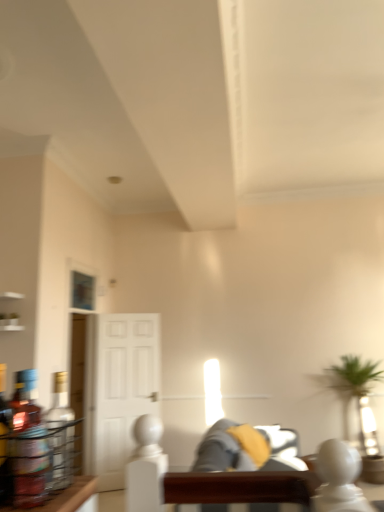
Describe the element at coordinates (60, 434) in the screenshot. Image resolution: width=384 pixels, height=512 pixels. I see `translucent glass bottle at left, the second bottle in the front-to-back sequence` at that location.

I want to click on translucent glass bottle at left, placed as the 1th bottle when sorted from front to back, so click(x=28, y=443).

At what (x,y) coordinates should I click in order to perform the action: click on white glossy door at center. Please return your answer as a coordinate pair (x, y). Looking at the image, I should click on (119, 389).

You are a GUI agent. You are given a task and a screenshot of the screen. Output one action in this format:
    pyautogui.click(x=<x>, y=<y>)
    Task: Click on the translucent glass bottle at left, the second bottle in the front-to-back sequence
    Image resolution: width=384 pixels, height=512 pixels.
    Given the screenshot: What is the action you would take?
    pyautogui.click(x=60, y=434)

Find the location of `glass door positioned vertically above the soft gray fabric couch at center, positioned as the second couch in back-to-front order (from a real-world perspective)`. glass door positioned vertically above the soft gray fabric couch at center, positioned as the second couch in back-to-front order (from a real-world perspective) is located at coordinates (119, 389).

Consider the image. From a real-world perspective, which is physically above, soft gray fabric couch at center, the 1th couch in the front-to-back sequence, or white glossy door at center?

white glossy door at center, from a real-world perspective.

Is soft gray fabric couch at center, positioned as the second couch in back-to-front order, beside white glossy door at center?

soft gray fabric couch at center, positioned as the second couch in back-to-front order, and white glossy door at center are clearly separated.

Can we say soft gray fabric couch at center, the 1th couch in the front-to-back sequence, lies outside white glossy door at center?

soft gray fabric couch at center, the 1th couch in the front-to-back sequence, is positioned outside white glossy door at center.

Is white glossy door at center inside or outside of soft gray fabric couch at center, positioned as the second couch in back-to-front order?

white glossy door at center is spatially situated outside soft gray fabric couch at center, positioned as the second couch in back-to-front order.

In the scene shown: Considering the relative sizes of white glossy door at center and soft gray fabric couch at center, the 1th couch in the front-to-back sequence, in the image provided, is white glossy door at center bigger than soft gray fabric couch at center, the 1th couch in the front-to-back sequence,?

Actually, white glossy door at center might be smaller than soft gray fabric couch at center, the 1th couch in the front-to-back sequence.

From a real-world perspective, relative to soft gray fabric couch at center, positioned as the second couch in back-to-front order, is white glossy door at center vertically above or below?

From a real-world perspective, white glossy door at center is physically above soft gray fabric couch at center, positioned as the second couch in back-to-front order.

Considering their positions, is white glossy door at center located in front of or behind soft gray fabric couch at center, the 1th couch in the front-to-back sequence?

white glossy door at center is behind soft gray fabric couch at center, the 1th couch in the front-to-back sequence.

Considering the sizes of objects gray fabric couch at center, arranged as the 2th couch when viewed from the front, and translucent glass bottle at left, the 1th bottle from the back, in the image provided, who is shorter, gray fabric couch at center, arranged as the 2th couch when viewed from the front, or translucent glass bottle at left, the 1th bottle from the back,?

translucent glass bottle at left, the 1th bottle from the back, is shorter.

Considering the relative sizes of gray fabric couch at center, arranged as the 2th couch when viewed from the front, and translucent glass bottle at left, the 1th bottle from the back, in the image provided, is gray fabric couch at center, arranged as the 2th couch when viewed from the front, bigger than translucent glass bottle at left, the 1th bottle from the back,?

Indeed, gray fabric couch at center, arranged as the 2th couch when viewed from the front, has a larger size compared to translucent glass bottle at left, the 1th bottle from the back.

Is gray fabric couch at center, the 1th couch positioned from the back, oriented towards translucent glass bottle at left, the second bottle in the front-to-back sequence?

No, gray fabric couch at center, the 1th couch positioned from the back, is not oriented towards translucent glass bottle at left, the second bottle in the front-to-back sequence.

Which is behind, point (217, 467) or point (64, 473)?

The point (217, 467) is farther from the camera.

Between white glossy door at center and translucent glass bottle at left, the second bottle in the front-to-back sequence, which one appears on the left side from the viewer's perspective?

white glossy door at center.

Locate an element on the screen. glass door below the translucent glass bottle at left, the second bottle in the front-to-back sequence (from the image's perspective) is located at coordinates (119, 389).

Is white glossy door at center shorter than translucent glass bottle at left, the second bottle in the front-to-back sequence?

In fact, white glossy door at center may be taller than translucent glass bottle at left, the second bottle in the front-to-back sequence.

Between white glossy door at center and translucent glass bottle at left, the 1th bottle from the back, which one has larger width?

With larger width is white glossy door at center.

The image size is (384, 512). I want to click on couch located on the left of soft gray fabric couch at center, positioned as the second couch in back-to-front order, so click(x=248, y=448).

Is soft gray fabric couch at center, the 1th couch in the front-to-back sequence, at the back of gray fabric couch at center, the 1th couch positioned from the back?

Absolutely, gray fabric couch at center, the 1th couch positioned from the back, is directed away from soft gray fabric couch at center, the 1th couch in the front-to-back sequence.

Considering the positions of objects gray fabric couch at center, the 1th couch positioned from the back, and soft gray fabric couch at center, the 1th couch in the front-to-back sequence, in the image provided, who is more to the left, gray fabric couch at center, the 1th couch positioned from the back, or soft gray fabric couch at center, the 1th couch in the front-to-back sequence,?

gray fabric couch at center, the 1th couch positioned from the back, is more to the left.

Between translucent glass bottle at left, the second bottle in the front-to-back sequence, and translucent glass bottle at left, placed as the 1th bottle when sorted from front to back, which one is positioned behind?

translucent glass bottle at left, the second bottle in the front-to-back sequence, is further away from the camera.

From a real-world perspective, is translucent glass bottle at left, the second bottle in the front-to-back sequence, on translucent glass bottle at left, marked as the second bottle in a back-to-front arrangement?

Yes, from a real-world perspective, translucent glass bottle at left, the second bottle in the front-to-back sequence, is on top of translucent glass bottle at left, marked as the second bottle in a back-to-front arrangement.

Is translucent glass bottle at left, the second bottle in the front-to-back sequence, wider than translucent glass bottle at left, marked as the second bottle in a back-to-front arrangement?

No, translucent glass bottle at left, the second bottle in the front-to-back sequence, is not wider than translucent glass bottle at left, marked as the second bottle in a back-to-front arrangement.

Is translucent glass bottle at left, the second bottle in the front-to-back sequence, turned away from translucent glass bottle at left, placed as the 1th bottle when sorted from front to back?

Yes, translucent glass bottle at left, the second bottle in the front-to-back sequence, is positioned with its back facing translucent glass bottle at left, placed as the 1th bottle when sorted from front to back.

Which of these two, translucent glass bottle at left, placed as the 1th bottle when sorted from front to back, or soft gray fabric couch at center, positioned as the second couch in back-to-front order, is bigger?

soft gray fabric couch at center, positioned as the second couch in back-to-front order.

Considering the positions of point (42, 488) and point (289, 461), is point (42, 488) closer or farther from the camera than point (289, 461)?

Point (42, 488).

Is translucent glass bottle at left, placed as the 1th bottle when sorted from front to back, facing towards soft gray fabric couch at center, positioned as the second couch in back-to-front order?

Yes, translucent glass bottle at left, placed as the 1th bottle when sorted from front to back, is aimed at soft gray fabric couch at center, positioned as the second couch in back-to-front order.

Between translucent glass bottle at left, marked as the second bottle in a back-to-front arrangement, and soft gray fabric couch at center, positioned as the second couch in back-to-front order, which one has less height?

translucent glass bottle at left, marked as the second bottle in a back-to-front arrangement.

The image size is (384, 512). Find the location of `glass door above the soft gray fabric couch at center, the 1th couch in the front-to-back sequence (from the image's perspective)`. glass door above the soft gray fabric couch at center, the 1th couch in the front-to-back sequence (from the image's perspective) is located at coordinates coord(119,389).

I want to click on glass door located above the soft gray fabric couch at center, positioned as the second couch in back-to-front order (from a real-world perspective), so click(x=119, y=389).

Based on their spatial positions, is gray fabric couch at center, the 1th couch positioned from the back, or translucent glass bottle at left, marked as the second bottle in a back-to-front arrangement, further from white glossy door at center?

translucent glass bottle at left, marked as the second bottle in a back-to-front arrangement.

When comparing their distances from translucent glass bottle at left, marked as the second bottle in a back-to-front arrangement, does translucent glass bottle at left, the 1th bottle from the back, or soft gray fabric couch at center, positioned as the second couch in back-to-front order, seem closer?

Based on the image, translucent glass bottle at left, the 1th bottle from the back, appears to be nearer to translucent glass bottle at left, marked as the second bottle in a back-to-front arrangement.

Which object lies further to the anchor point white glossy door at center, translucent glass bottle at left, placed as the 1th bottle when sorted from front to back, or soft gray fabric couch at center, the 1th couch in the front-to-back sequence?

Among the two, translucent glass bottle at left, placed as the 1th bottle when sorted from front to back, is located further to white glossy door at center.

When comparing their distances from white glossy door at center, does gray fabric couch at center, the 1th couch positioned from the back, or translucent glass bottle at left, the second bottle in the front-to-back sequence, seem closer?

The object closer to white glossy door at center is translucent glass bottle at left, the second bottle in the front-to-back sequence.

Based on the photo, looking at the image, which one is located further to soft gray fabric couch at center, the 1th couch in the front-to-back sequence, gray fabric couch at center, the 1th couch positioned from the back, or translucent glass bottle at left, the second bottle in the front-to-back sequence?

translucent glass bottle at left, the second bottle in the front-to-back sequence, is further to soft gray fabric couch at center, the 1th couch in the front-to-back sequence.

Considering their positions, is white glossy door at center positioned closer to translucent glass bottle at left, the 1th bottle from the back, than translucent glass bottle at left, marked as the second bottle in a back-to-front arrangement?

translucent glass bottle at left, marked as the second bottle in a back-to-front arrangement.

Looking at the image, which one is located further to translucent glass bottle at left, the 1th bottle from the back, soft gray fabric couch at center, positioned as the second couch in back-to-front order, or translucent glass bottle at left, marked as the second bottle in a back-to-front arrangement?

soft gray fabric couch at center, positioned as the second couch in back-to-front order, is further to translucent glass bottle at left, the 1th bottle from the back.

Considering their positions, is translucent glass bottle at left, placed as the 1th bottle when sorted from front to back, positioned further to gray fabric couch at center, arranged as the 2th couch when viewed from the front, than white glossy door at center?

Based on the image, translucent glass bottle at left, placed as the 1th bottle when sorted from front to back, appears to be further to gray fabric couch at center, arranged as the 2th couch when viewed from the front.

The height and width of the screenshot is (512, 384). I want to click on bottle located between translucent glass bottle at left, marked as the second bottle in a back-to-front arrangement, and gray fabric couch at center, the 1th couch positioned from the back, in the depth direction, so click(x=60, y=434).

Where is `bottle between translucent glass bottle at left, marked as the second bottle in a back-to-front arrangement, and soft gray fabric couch at center, the 1th couch in the front-to-back sequence, from top to bottom`? Image resolution: width=384 pixels, height=512 pixels. bottle between translucent glass bottle at left, marked as the second bottle in a back-to-front arrangement, and soft gray fabric couch at center, the 1th couch in the front-to-back sequence, from top to bottom is located at coordinates (60, 434).

The image size is (384, 512). Find the location of `couch between translucent glass bottle at left, placed as the 1th bottle when sorted from front to back, and gray fabric couch at center, arranged as the 2th couch when viewed from the front, from front to back`. couch between translucent glass bottle at left, placed as the 1th bottle when sorted from front to back, and gray fabric couch at center, arranged as the 2th couch when viewed from the front, from front to back is located at coordinates (241, 471).

Identify the location of bottle positioned between translucent glass bottle at left, placed as the 1th bottle when sorted from front to back, and white glossy door at center from near to far. (60, 434).